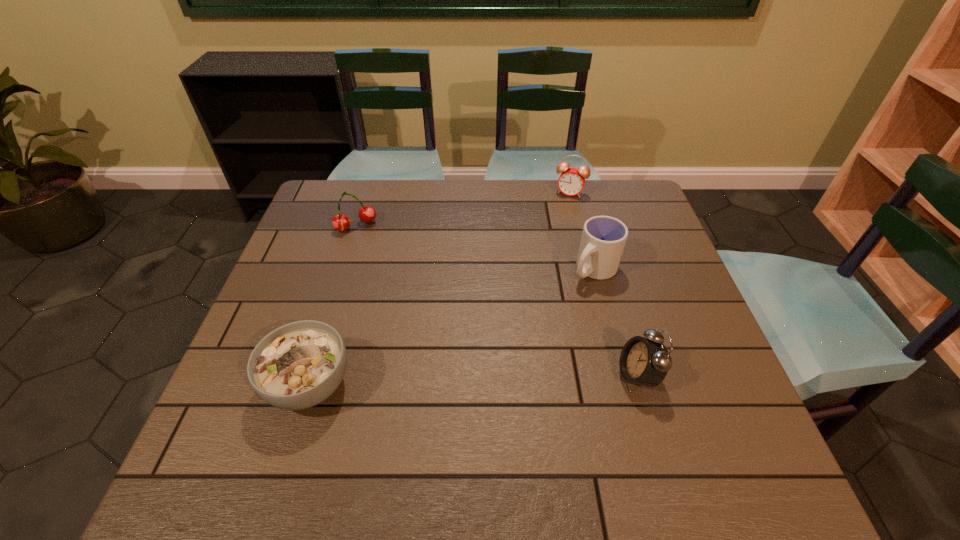
This screenshot has height=540, width=960. In order to click on free area in between the cherry and the third farthest object in this screenshot , I will do `click(475, 248)`.

The width and height of the screenshot is (960, 540). Find the location of `free space between the shortest object and the farther alarm clock`. free space between the shortest object and the farther alarm clock is located at coordinates (440, 288).

Locate an element on the screen. unoccupied position between the farther alarm clock and the soup bowl is located at coordinates (440, 288).

Where is `free space between the nearer alarm clock and the fourth nearest object`? The image size is (960, 540). free space between the nearer alarm clock and the fourth nearest object is located at coordinates tap(496, 301).

Locate an element on the screen. This screenshot has width=960, height=540. free space between the nearer alarm clock and the farthest object is located at coordinates coord(604,284).

Locate which object ranks in proximity to the nearer alarm clock. Please provide its 2D coordinates. Your answer should be formatted as a tuple, i.e. [(x, y)], where the tuple contains the x and y coordinates of a point satisfying the conditions above.

[(603, 239)]

Locate an element on the screen. This screenshot has height=540, width=960. object that stands as the fourth closest to the nearer alarm clock is located at coordinates (340, 222).

You are a GUI agent. You are given a task and a screenshot of the screen. Output one action in this format:
    pyautogui.click(x=<x>, y=<y>)
    Task: Click on the vacant area in the image that satisfies the following two spatial constraints: 1. on the back side of the nearer alarm clock; 2. on the face of the soup bowl
    The height and width of the screenshot is (540, 960).
    Given the screenshot: What is the action you would take?
    click(312, 376)

Where is `free space that satisfies the following two spatial constraints: 1. on the front side of the cherry; 2. on the right side of the cup`? The image size is (960, 540). free space that satisfies the following two spatial constraints: 1. on the front side of the cherry; 2. on the right side of the cup is located at coordinates (343, 269).

At what (x,y) coordinates should I click in order to perform the action: click on free space that satisfies the following two spatial constraints: 1. on the back side of the nearer alarm clock; 2. on the face of the soup bowl. Please return your answer as a coordinate pair (x, y). The width and height of the screenshot is (960, 540). Looking at the image, I should click on (312, 376).